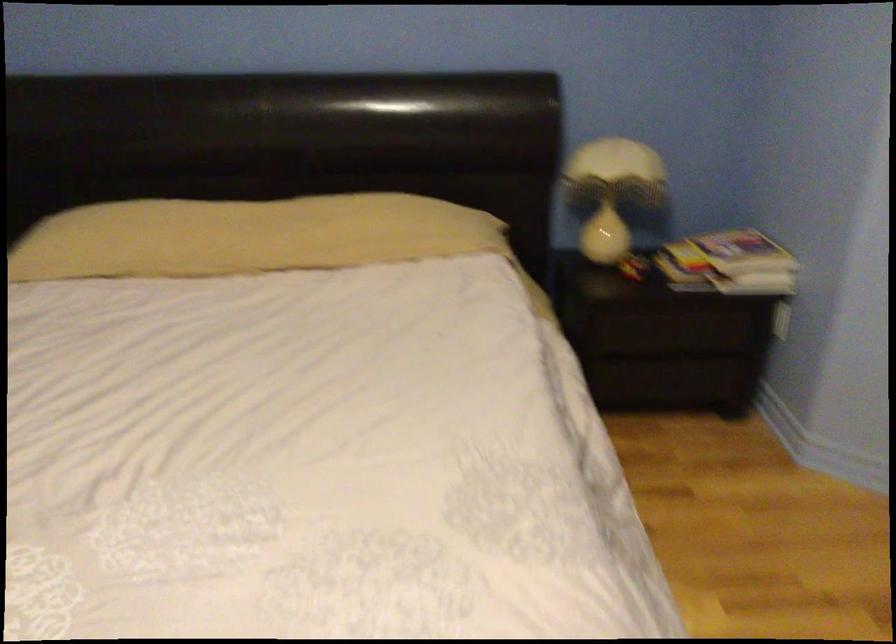
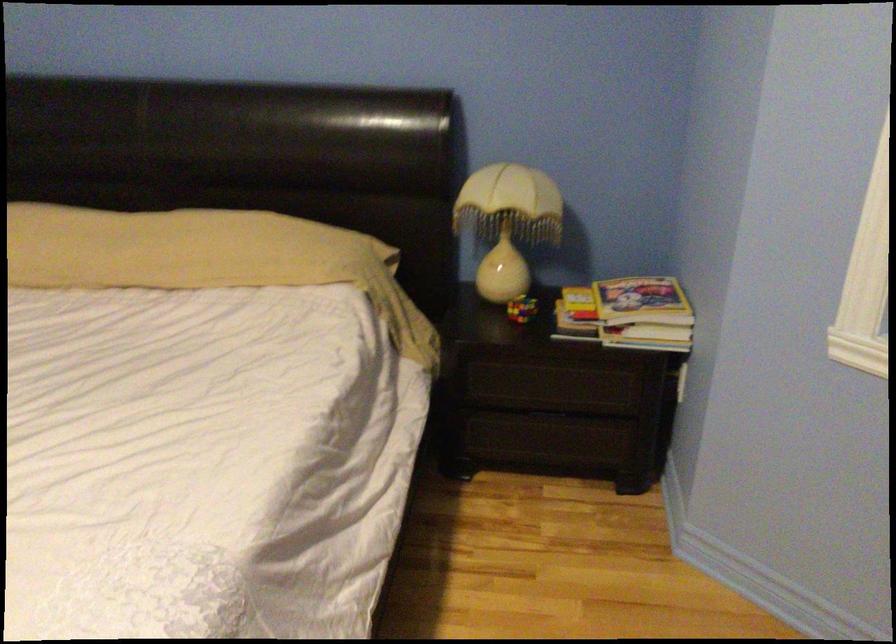
Where in the second image is the point corresponding to (x=748, y=243) from the first image?

(642, 301)